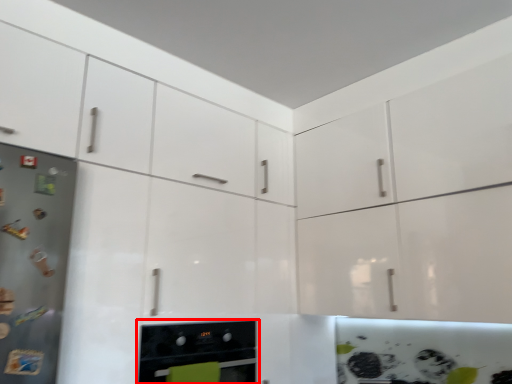
Question: From the image, what is the correct spatial relationship of home appliance (annotated by the red box) in relation to appliance?

Choices:
 (A) right
 (B) left

Answer: (A)